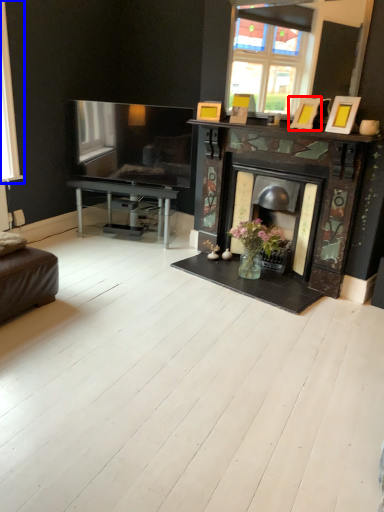
Question: Which point is further to the camera, picture frame (highlighted by a red box) or window (highlighted by a blue box)?

Choices:
 (A) picture frame
 (B) window

Answer: (B)